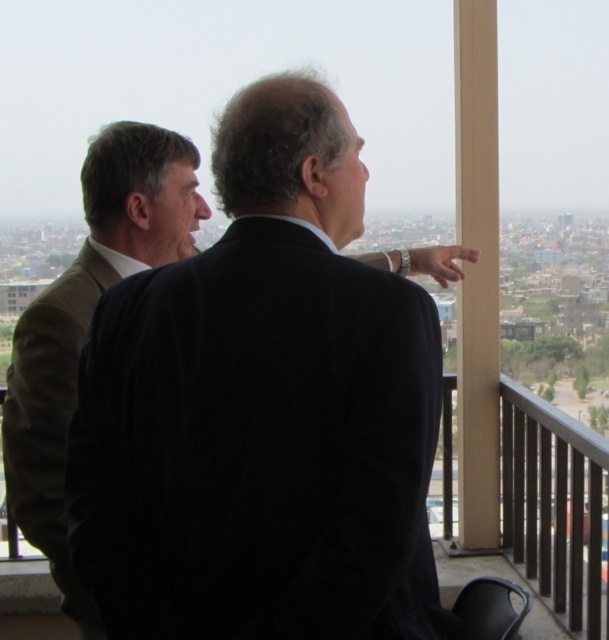
Question: Is the position of black matte suit at upper center more distant than that of brown woolen suit at left?

Choices:
 (A) yes
 (B) no

Answer: (B)

Question: Which point is farther to the camera?

Choices:
 (A) (188, 177)
 (B) (132, 616)

Answer: (A)

Question: Can you confirm if black matte suit at upper center is positioned below brown woolen suit at left?

Choices:
 (A) yes
 (B) no

Answer: (A)

Question: Can you confirm if black matte suit at upper center is positioned to the left of brown woolen suit at left?

Choices:
 (A) no
 (B) yes

Answer: (A)

Question: Which point is closer to the camera?

Choices:
 (A) brown woolen suit at left
 (B) black matte suit at upper center

Answer: (B)

Question: Which object appears closest to the camera in this image?

Choices:
 (A) brown woolen suit at left
 (B) black matte suit at upper center

Answer: (B)